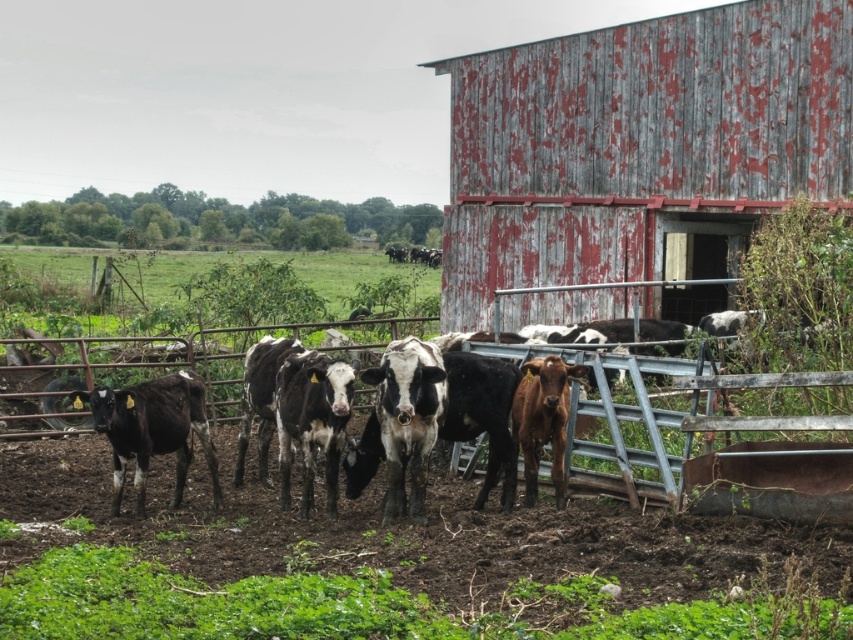
Question: Can you confirm if black and white cow at center is positioned above brown glossy calf at center?

Choices:
 (A) yes
 (B) no

Answer: (A)

Question: Considering the relative positions of black and white speckled cow at center and black and white cow at center in the image provided, where is black and white speckled cow at center located with respect to black and white cow at center?

Choices:
 (A) below
 (B) above

Answer: (A)

Question: Which of the following is the farthest from the observer?

Choices:
 (A) brown glossy calf at center
 (B) black glossy cow at left
 (C) black and white speckled cow at center

Answer: (A)

Question: Which of the following is the closest to the observer?

Choices:
 (A) black and white cow at center
 (B) peeling gray wood barn at right
 (C) brown glossy calf at center
 (D) black glossy cow at left

Answer: (A)

Question: Which object is positioned closest to the black and white cow at center?

Choices:
 (A) black and white speckled cow at center
 (B) black glossy cow at left
 (C) brown glossy calf at center

Answer: (A)

Question: Is peeling gray wood barn at right to the left of black and white speckled cow at center from the viewer's perspective?

Choices:
 (A) yes
 (B) no

Answer: (B)